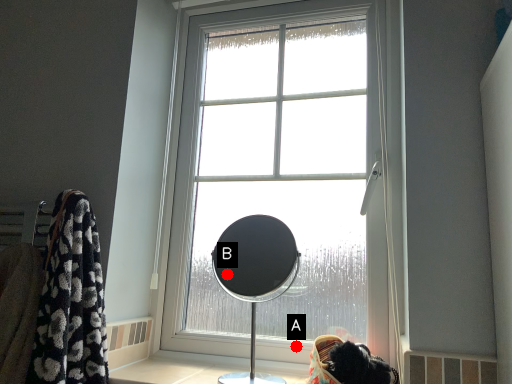
Question: Two points are circled on the image, labeled by A and B beside each circle. Which point appears closest to the camera in this image?

Choices:
 (A) A is closer
 (B) B is closer

Answer: (A)